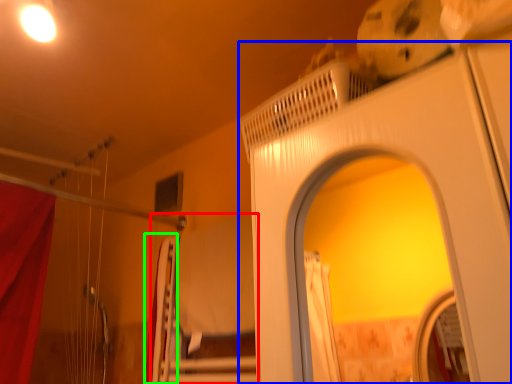
Question: Which object is the farthest from bed (highlighted by a red box)? Choose among these: screen door (highlighted by a blue box) or curtain (highlighted by a green box).

Choices:
 (A) screen door
 (B) curtain

Answer: (A)